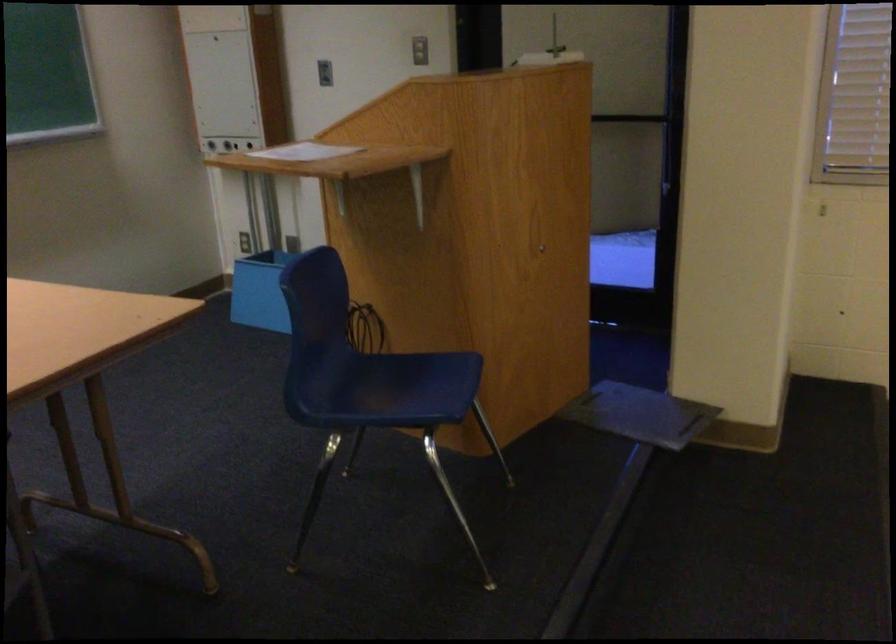
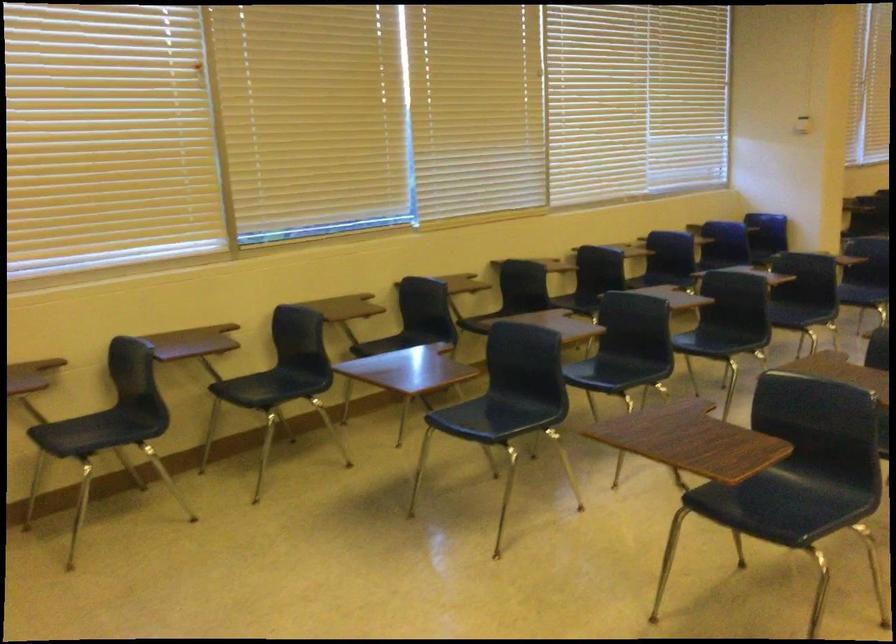
Question: The first image is from the beginning of the video and the second image is from the end. How did the camera likely rotate when shooting the video?

Choices:
 (A) Left
 (B) Right
 (C) Up
 (D) Down

Answer: (B)